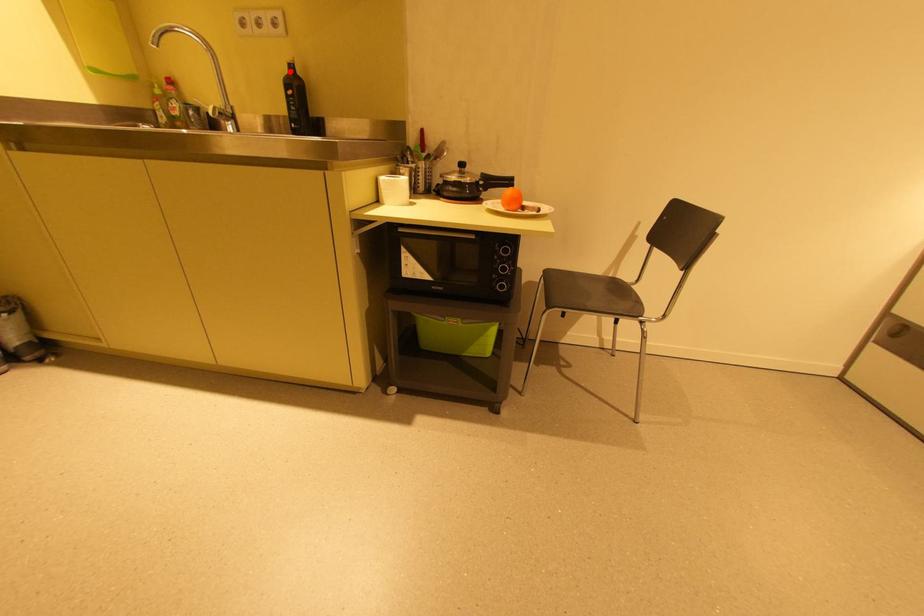
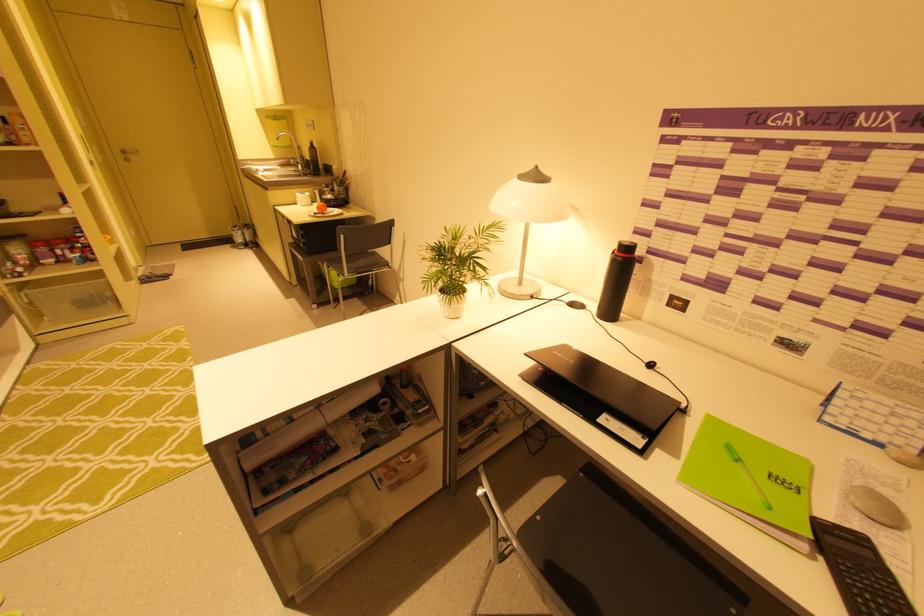
Question: I am providing you with two images of the same scene from different viewpoints. In image1, a red point is highlighted. Considering the same 3D point in image2, which of the following is correct?

Choices:
 (A) It is closer
 (B) It is farther

Answer: (A)